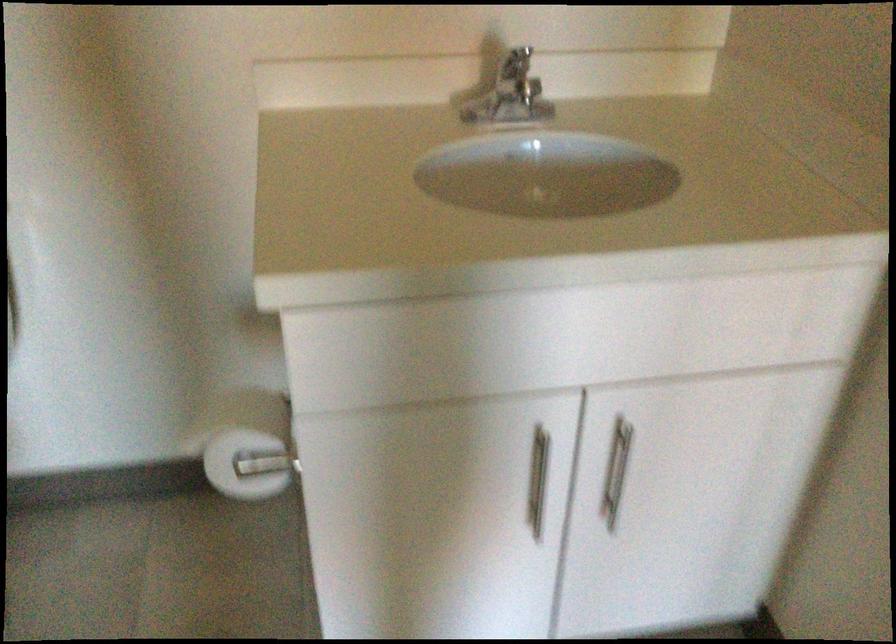
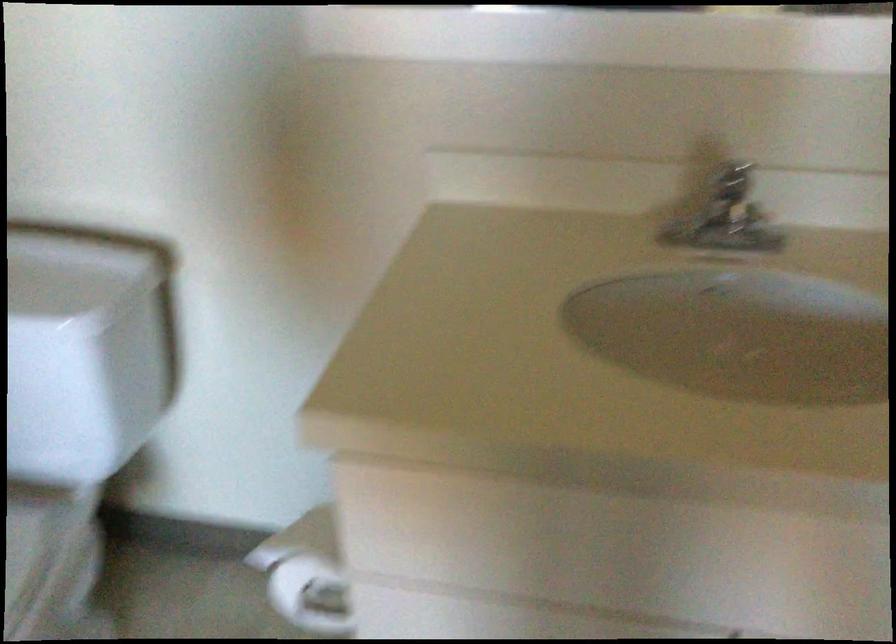
Question: The camera is either moving clockwise (left) or counter-clockwise (right) around the object. The first image is from the beginning of the video and the second image is from the end. Is the camera moving left or right when shooting the video?

Choices:
 (A) Left
 (B) Right

Answer: (B)